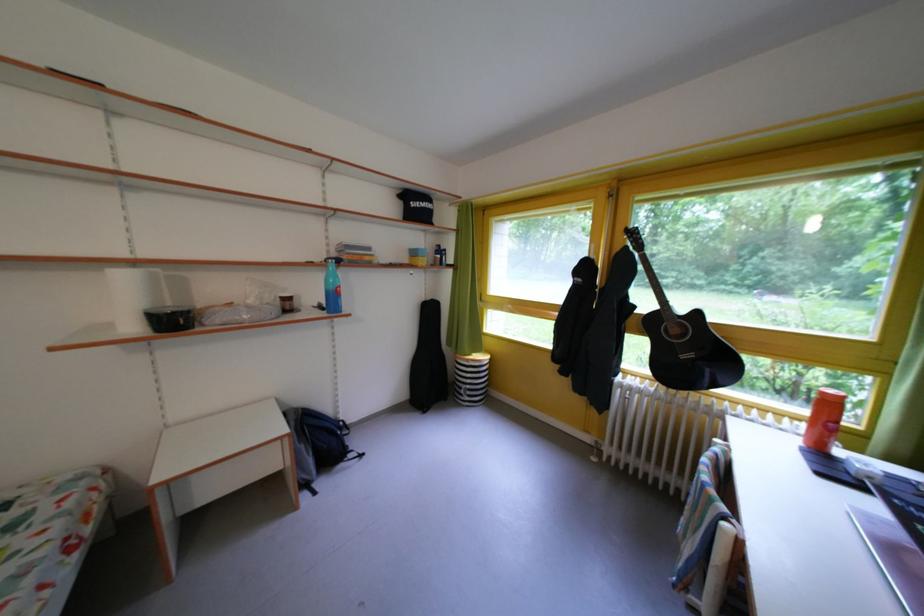
Describe the element at coordinates (605, 232) in the screenshot. The width and height of the screenshot is (924, 616). I see `the window handle` at that location.